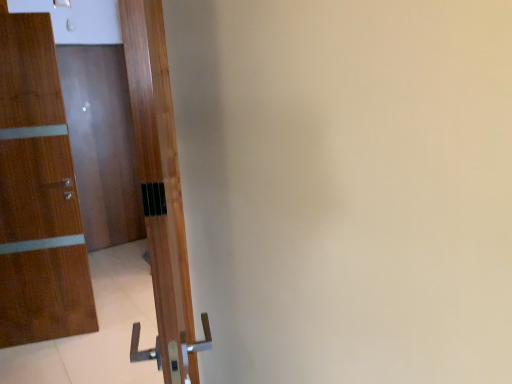
Question: Could glossy wood door at left, which is counted as the 3th door, starting from the front, be considered to be inside wooden door at left, the second door viewed from the left?

Choices:
 (A) no
 (B) yes

Answer: (A)

Question: Is wooden door at left, acting as the second door starting from the front, positioned beyond the bounds of glossy wood door at left, the 3th door when ordered from right to left?

Choices:
 (A) no
 (B) yes

Answer: (B)

Question: Is wooden door at left, acting as the second door starting from the front, at the left side of glossy wood door at left, the 3th door when ordered from right to left?

Choices:
 (A) no
 (B) yes

Answer: (A)

Question: From a real-world perspective, does wooden door at left, the second door viewed from the left, sit lower than glossy wood door at left, acting as the 1th door starting from the back?

Choices:
 (A) no
 (B) yes

Answer: (B)

Question: Does wooden door at left, the second door positioned from the right, have a smaller size compared to glossy wood door at left, which is the 1th door in left-to-right order?

Choices:
 (A) no
 (B) yes

Answer: (A)

Question: Does wooden door at left, the second door from the back, have a greater width compared to glossy wood door at left, which is counted as the 3th door, starting from the front?

Choices:
 (A) no
 (B) yes

Answer: (B)

Question: Is glossy wood door at left, which is the 1th door in left-to-right order, far from wooden door at left, positioned as the third door in back-to-front order?

Choices:
 (A) yes
 (B) no

Answer: (A)

Question: From the image's perspective, is glossy wood door at left, the 3th door when ordered from right to left, over wooden door at left, placed as the 1th door when sorted from front to back?

Choices:
 (A) yes
 (B) no

Answer: (A)

Question: Can you confirm if glossy wood door at left, the 3th door when ordered from right to left, is bigger than wooden door at left, acting as the third door starting from the left?

Choices:
 (A) no
 (B) yes

Answer: (A)

Question: Does glossy wood door at left, which is the 1th door in left-to-right order, have a greater width compared to wooden door at left, placed as the 1th door when sorted from front to back?

Choices:
 (A) yes
 (B) no

Answer: (B)

Question: Considering the relative sizes of glossy wood door at left, which is counted as the 3th door, starting from the front, and wooden door at left, positioned as the third door in back-to-front order, in the image provided, is glossy wood door at left, which is counted as the 3th door, starting from the front, thinner than wooden door at left, positioned as the third door in back-to-front order,?

Choices:
 (A) yes
 (B) no

Answer: (A)

Question: Is glossy wood door at left, acting as the 1th door starting from the back, positioned before wooden door at left, positioned as the third door in back-to-front order?

Choices:
 (A) yes
 (B) no

Answer: (B)

Question: Is wooden door at left, the second door positioned from the right, positioned behind wooden door at left, positioned as the third door in back-to-front order?

Choices:
 (A) yes
 (B) no

Answer: (A)